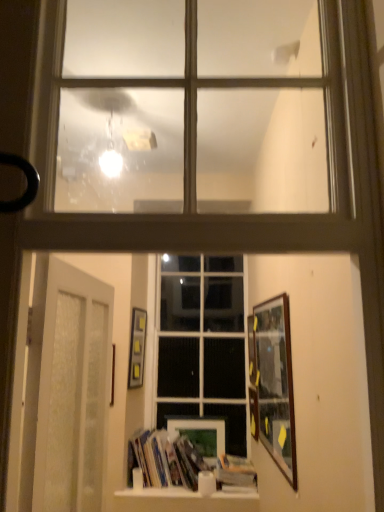
Question: Would you say white frosted glass door at lower left is part of black rubber door handle at left's contents?

Choices:
 (A) no
 (B) yes

Answer: (A)

Question: Does black rubber door handle at left have a lesser width compared to white frosted glass door at lower left?

Choices:
 (A) no
 (B) yes

Answer: (A)

Question: Is black rubber door handle at left bigger than white frosted glass door at lower left?

Choices:
 (A) yes
 (B) no

Answer: (B)

Question: Is black rubber door handle at left to the right of white frosted glass door at lower left from the viewer's perspective?

Choices:
 (A) no
 (B) yes

Answer: (A)

Question: Are black rubber door handle at left and white frosted glass door at lower left making contact?

Choices:
 (A) no
 (B) yes

Answer: (A)

Question: From their relative heights in the image, would you say white frosted glass door at lower left is taller or shorter than clear glass window at center, the 1th window from the back?

Choices:
 (A) tall
 (B) short

Answer: (B)

Question: Is white frosted glass door at lower left spatially inside clear glass window at center, the 1th window from the bottom, or outside of it?

Choices:
 (A) inside
 (B) outside

Answer: (B)

Question: Relative to clear glass window at center, the second window in the top-to-bottom sequence, is white frosted glass door at lower left in front or behind?

Choices:
 (A) behind
 (B) front

Answer: (B)

Question: Considering the positions of white frosted glass door at lower left and clear glass window at center, which is the 2th window in front-to-back order, in the image, is white frosted glass door at lower left bigger or smaller than clear glass window at center, which is the 2th window in front-to-back order,?

Choices:
 (A) big
 (B) small

Answer: (B)

Question: From a real-world perspective, is wooden picture frame at right, which appears as the 3th picture frame when viewed from the right, positioned above or below wooden picture frame at center, which ranks as the 4th picture frame in left-to-right order?

Choices:
 (A) below
 (B) above

Answer: (B)

Question: Is wooden picture frame at right, marked as the 3th picture frame in a left-to-right arrangement, taller or shorter than wooden picture frame at center, which ranks as the 4th picture frame in left-to-right order?

Choices:
 (A) short
 (B) tall

Answer: (B)

Question: Visually, is wooden picture frame at right, which appears as the 3th picture frame when viewed from the right, positioned to the left or to the right of wooden picture frame at center, marked as the second picture frame in a right-to-left arrangement?

Choices:
 (A) left
 (B) right

Answer: (A)

Question: Considering their positions, is wooden picture frame at right, marked as the 3th picture frame in a left-to-right arrangement, located in front of or behind wooden picture frame at center, which ranks as the 4th picture frame in left-to-right order?

Choices:
 (A) behind
 (B) front

Answer: (B)

Question: From the image's perspective, is white frosted glass door at lower left positioned above or below wooden picture frame at center, the 1th picture frame from the right?

Choices:
 (A) below
 (B) above

Answer: (B)

Question: Considering the positions of white frosted glass door at lower left and wooden picture frame at center, the 1th picture frame from the right, in the image, is white frosted glass door at lower left bigger or smaller than wooden picture frame at center, the 1th picture frame from the right,?

Choices:
 (A) big
 (B) small

Answer: (A)